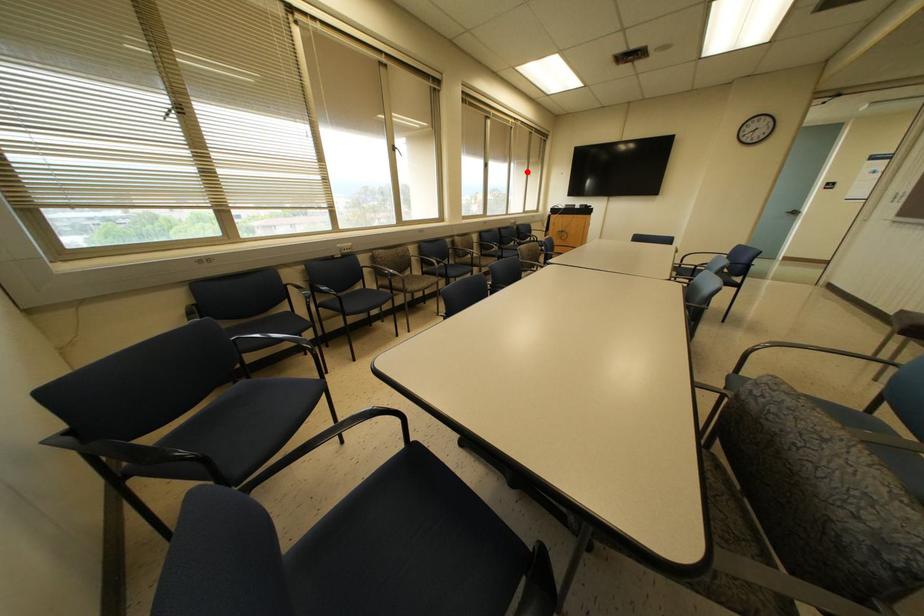
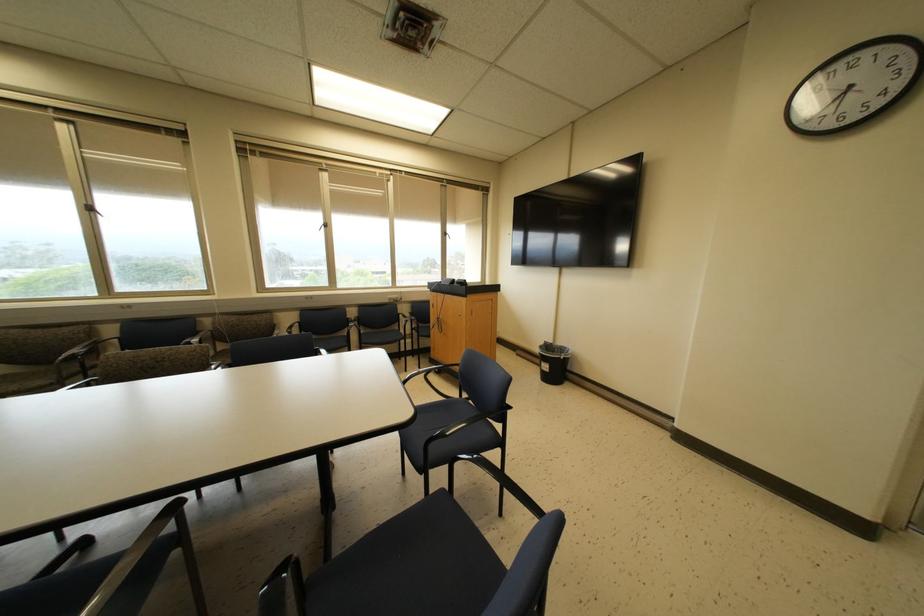
Locate, in the second image, the point that corresponds to the highlighted location in the first image.

(444, 233)